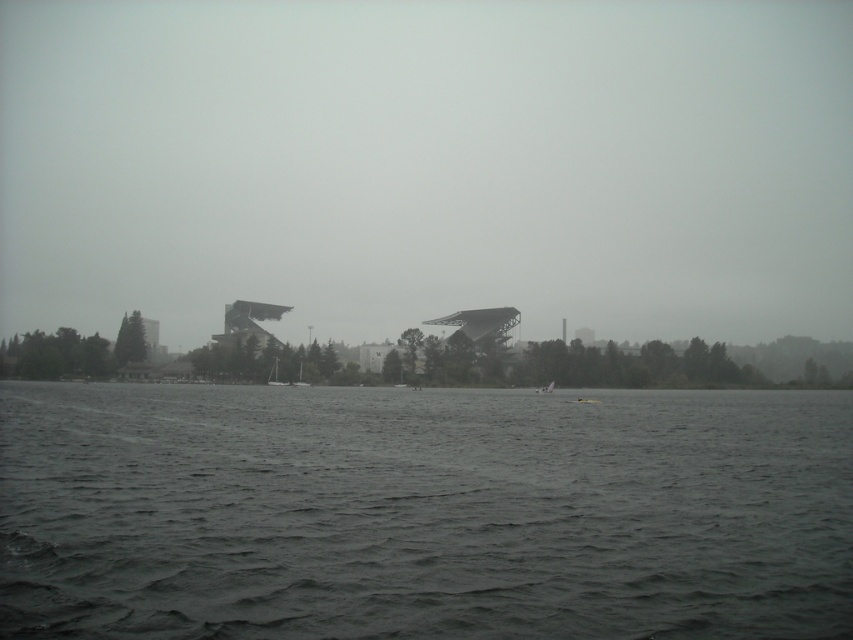
You are a photographer trying to capture both the white plastic sailboat at center and the white matte sailboat at center in the same frame. Given their heights, which boat will appear larger in your photo?

The white plastic sailboat at center is much taller than the white matte sailboat at center, so it will appear larger in the photo.

You are planning to place both the white plastic sailboat at center and the white matte sailboat at center on the water. Given the space between the two stadium structures in the background, which boat would you choose to ensure it fits comfortably without overlapping the other?

The white plastic sailboat at center is wider than the white matte sailboat at center, so you should choose the white matte sailboat at center to ensure it fits comfortably without overlapping the other.

You are a photographer planning to take a photo of both the white plastic sailboat at center and the white matte sailboat at center. The camera you are using has a maximum focus range of 3 meters. Can you capture both boats in focus without moving the camera?

The white plastic sailboat at center and white matte sailboat at center are 2.57 meters apart. Since the distance between them is within the camera maximum focus range of 3 meters, you can capture both boats in focus without moving the camera.